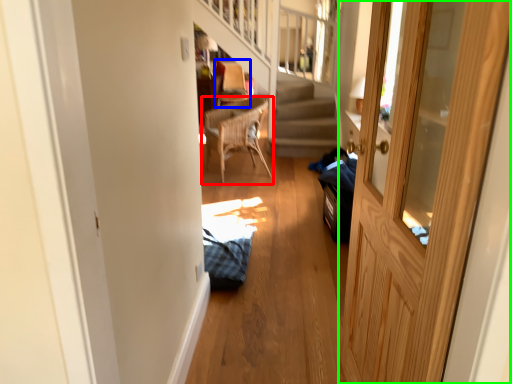
Question: Estimate the real-world distances between objects in this image. Which object is farther from chair (highlighted by a red box), armchair (highlighted by a blue box) or door (highlighted by a green box)?

Choices:
 (A) armchair
 (B) door

Answer: (B)